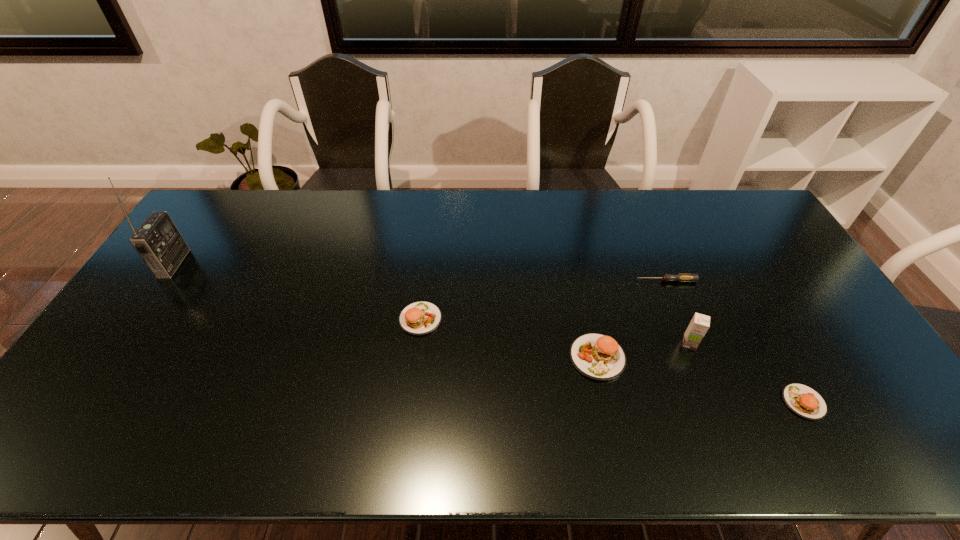
Locate an element on the screen. This screenshot has height=540, width=960. free spot located 0.110m on the front of the second shortest patty is located at coordinates (415, 370).

At what (x,y) coordinates should I click in order to perform the action: click on vacant space situated on the back of the third tallest object. Please return your answer as a coordinate pair (x, y). This screenshot has width=960, height=540. Looking at the image, I should click on (577, 265).

Find the location of a particular element. The width and height of the screenshot is (960, 540). free space located 0.370m on the left of the shortest patty is located at coordinates (634, 402).

I want to click on vacant space situated on the display of the leftmost object, so click(222, 263).

This screenshot has width=960, height=540. I want to click on free space located 0.290m insert the screwdriver into a screw head, so click(543, 281).

Find the location of a particular element. Image resolution: width=960 pixels, height=540 pixels. vacant space positioned 0.380m insert the screwdriver into a screw head is located at coordinates (515, 281).

Identify the location of free location located 0.390m insert the screwdriver into a screw head. This screenshot has height=540, width=960. (512, 281).

Where is `vacant area located 0.070m on the left of the fifth shortest object`? This screenshot has width=960, height=540. vacant area located 0.070m on the left of the fifth shortest object is located at coordinates (655, 343).

Locate an element on the screen. object that is at the left edge is located at coordinates (157, 240).

The image size is (960, 540). I want to click on free space at the far edge of the desktop, so [248, 218].